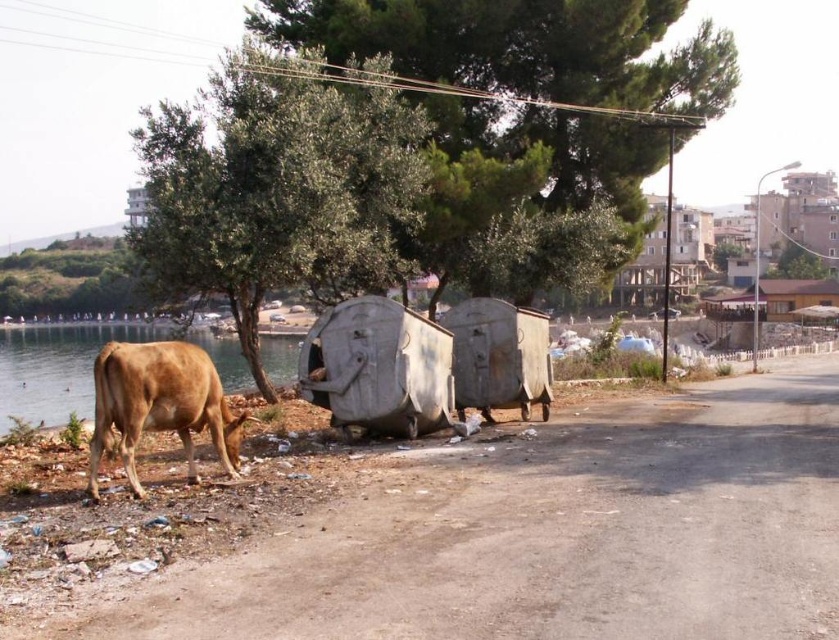
Question: Among these objects, which one is farthest from the camera?

Choices:
 (A) brown leather cow at lower left
 (B) brown matte cow at lower left
 (C) green leafy tree at upper left
 (D) green leafy tree at upper center

Answer: (D)

Question: Is green leafy tree at upper left further to the viewer compared to green leafy tree at upper center?

Choices:
 (A) yes
 (B) no

Answer: (B)

Question: Which point is closer to the camera?

Choices:
 (A) (102, 365)
 (B) (50, 337)
 (C) (331, 54)

Answer: (A)

Question: Is green leafy tree at upper left to the right of brown matte cow at lower left from the viewer's perspective?

Choices:
 (A) no
 (B) yes

Answer: (B)

Question: Which point is closer to the camera?

Choices:
 (A) (336, 284)
 (B) (193, 378)
 (C) (4, 410)
 (D) (522, 8)

Answer: (B)

Question: Does brown matte cow at lower left have a lesser width compared to brown leather cow at lower left?

Choices:
 (A) no
 (B) yes

Answer: (B)